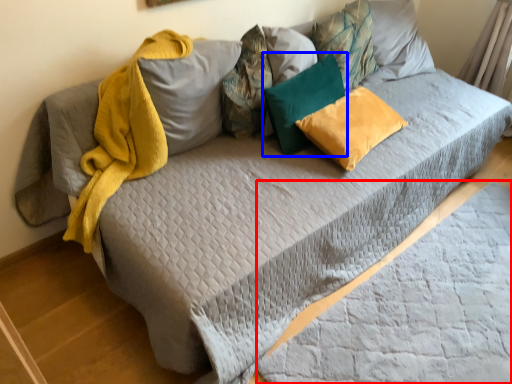
Question: Among these objects, which one is farthest to the camera, sheet (highlighted by a red box) or pillow (highlighted by a blue box)?

Choices:
 (A) sheet
 (B) pillow

Answer: (B)